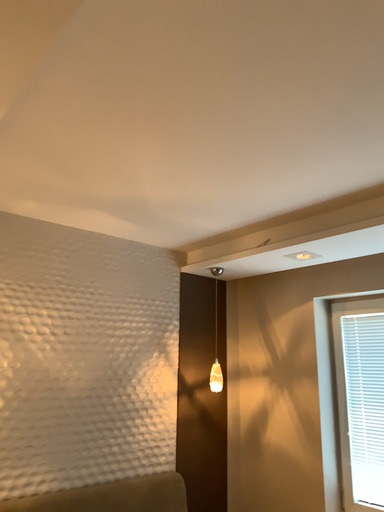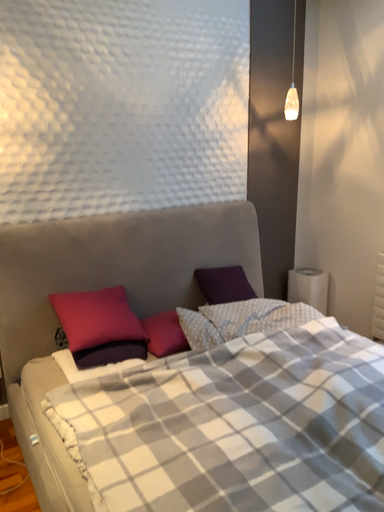
Question: Which way did the camera rotate in the video?

Choices:
 (A) rotated right
 (B) rotated left

Answer: (B)